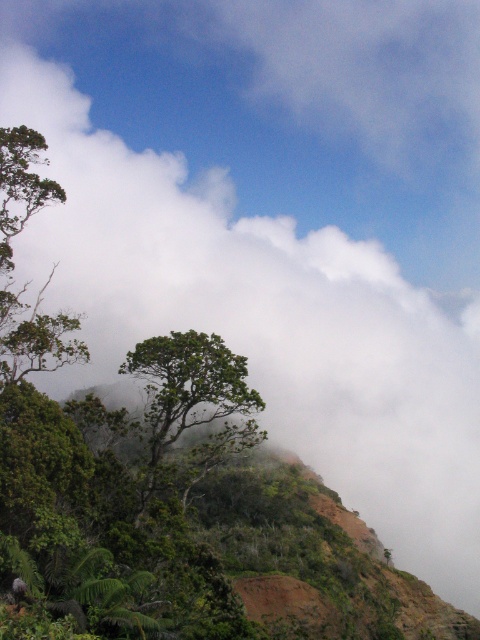
Which is more to the left, green leafy tree at left or green leafy tree at center?

green leafy tree at left is more to the left.

Who is higher up, green leafy tree at left or green leafy tree at center?

green leafy tree at left

Between point (82, 349) and point (218, 401), which one is positioned behind?

The point (218, 401) is more distant.

The image size is (480, 640). In order to click on green leafy tree at left in this screenshot , I will do `click(13, 266)`.